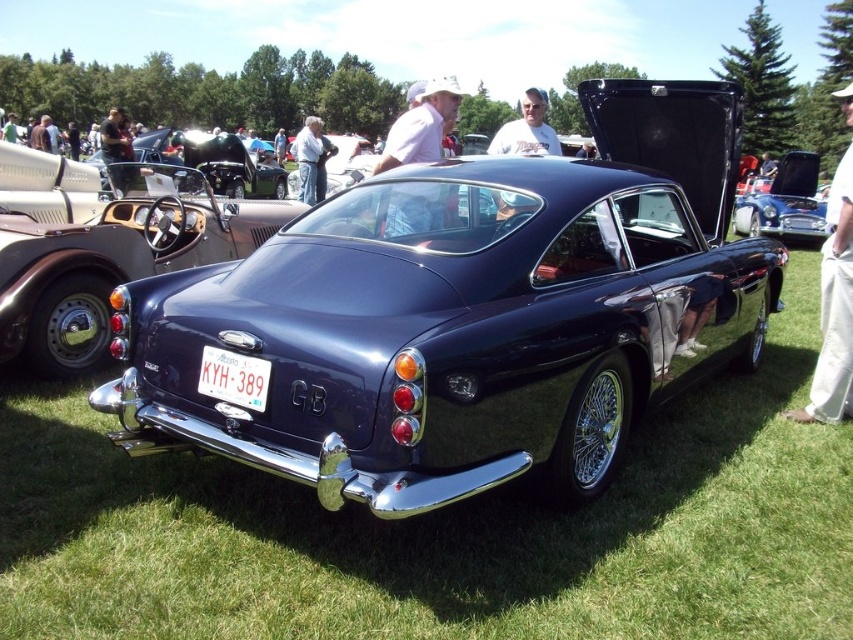
Image resolution: width=853 pixels, height=640 pixels. Describe the element at coordinates (782, 200) in the screenshot. I see `glossy blue car at center` at that location.

Locate an element on the screen. The height and width of the screenshot is (640, 853). glossy blue car at center is located at coordinates (782, 200).

Is shiny black car at center above white plastic license plate at center?

Yes.

Can you confirm if shiny black car at center is shorter than white plastic license plate at center?

No, shiny black car at center is not shorter than white plastic license plate at center.

Is point (163, 147) closer to camera compared to point (252, 385)?

No, it is behind (252, 385).

Where is `shiny black car at center`? The image size is (853, 640). shiny black car at center is located at coordinates (215, 161).

Between shiny black car at center and glossy blue car at center, which one has less height?

glossy blue car at center is shorter.

Is shiny black car at center wider than glossy blue car at center?

Yes.

Who is more forward, (247, 195) or (805, 227)?

Point (805, 227) is more forward.

This screenshot has width=853, height=640. In order to click on shiny black car at center in this screenshot , I will do `click(215, 161)`.